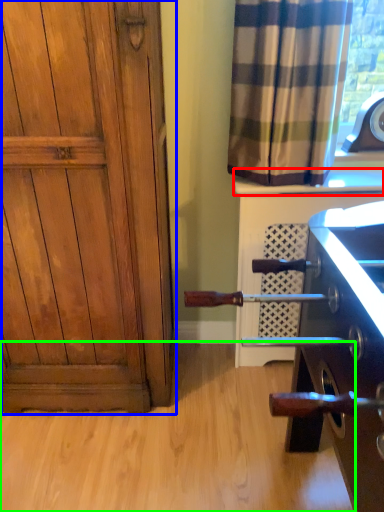
Question: Which object is the closest to the window sill (highlighted by a red box)? Choose among these: door (highlighted by a blue box) or plain (highlighted by a green box).

Choices:
 (A) door
 (B) plain

Answer: (A)